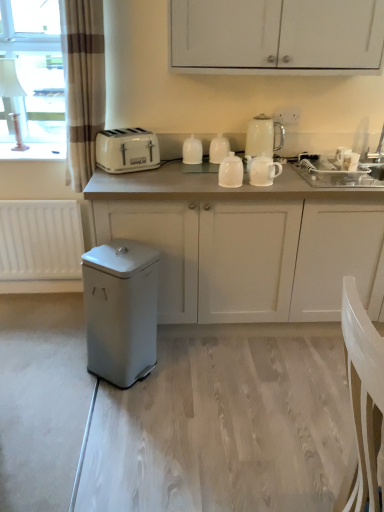
The height and width of the screenshot is (512, 384). In order to click on vacant area that lies to the right of white glossy kettle at upper center, marked as the 1th kitchen appliance in a right-to-left arrangement in this screenshot , I will do `click(284, 161)`.